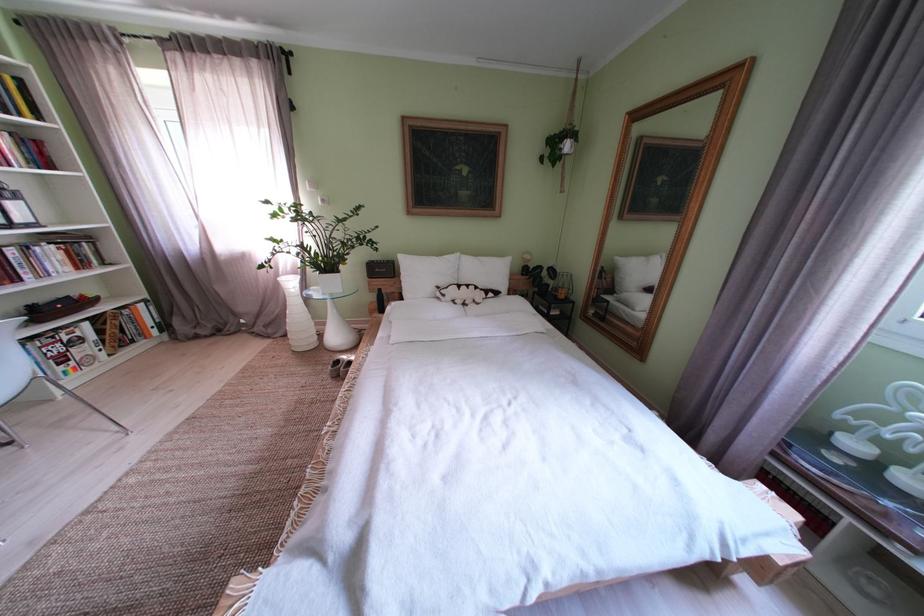
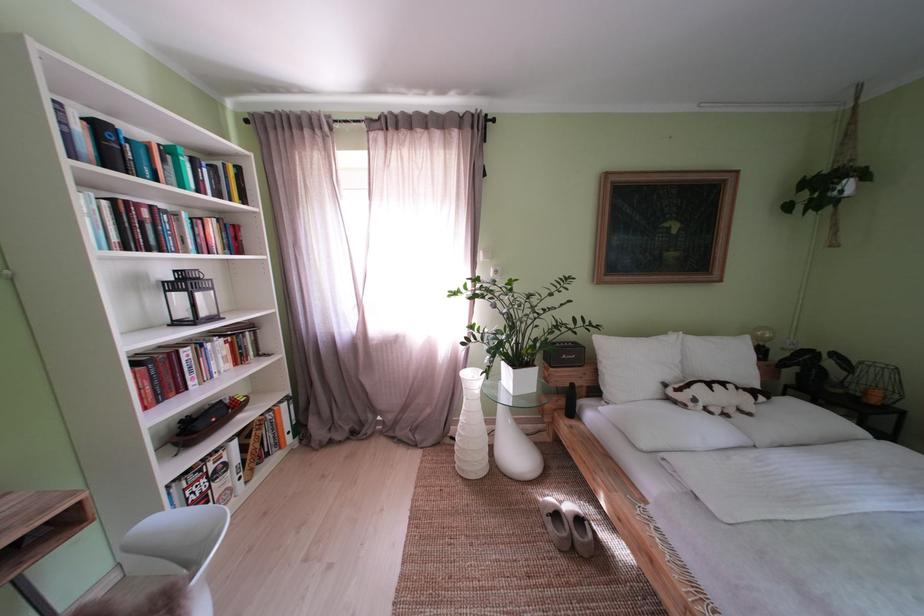
Where in the second image is the point corresponding to point (455, 301) from the first image?

(706, 406)